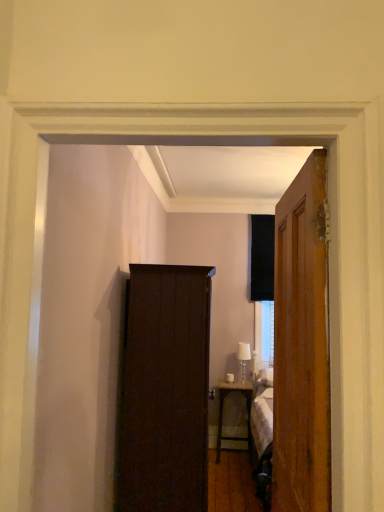
Question: Can you confirm if dark wood cabinet at center is shorter than metallic silver desk at center?

Choices:
 (A) yes
 (B) no

Answer: (B)

Question: Would you consider dark wood cabinet at center to be distant from metallic silver desk at center?

Choices:
 (A) no
 (B) yes

Answer: (B)

Question: Is dark wood cabinet at center facing away from metallic silver desk at center?

Choices:
 (A) yes
 (B) no

Answer: (B)

Question: From the image's perspective, is dark wood cabinet at center below metallic silver desk at center?

Choices:
 (A) yes
 (B) no

Answer: (B)

Question: From a real-world perspective, is dark wood cabinet at center on top of metallic silver desk at center?

Choices:
 (A) no
 (B) yes

Answer: (B)

Question: Is metallic silver desk at center wider or thinner than wooden door at right?

Choices:
 (A) thin
 (B) wide

Answer: (B)

Question: Considering the positions of metallic silver desk at center and wooden door at right in the image, is metallic silver desk at center taller or shorter than wooden door at right?

Choices:
 (A) tall
 (B) short

Answer: (B)

Question: Is metallic silver desk at center in front of or behind wooden door at right in the image?

Choices:
 (A) behind
 (B) front

Answer: (A)

Question: From the image's perspective, is metallic silver desk at center above or below wooden door at right?

Choices:
 (A) above
 (B) below

Answer: (B)

Question: From the image's perspective, is dark wood cabinet at center above or below wooden door at right?

Choices:
 (A) below
 (B) above

Answer: (A)

Question: Is point (162, 309) positioned closer to the camera than point (324, 467)?

Choices:
 (A) farther
 (B) closer

Answer: (A)

Question: Is dark wood cabinet at center in front of or behind wooden door at right in the image?

Choices:
 (A) front
 (B) behind

Answer: (B)

Question: Considering the positions of dark wood cabinet at center and wooden door at right in the image, is dark wood cabinet at center bigger or smaller than wooden door at right?

Choices:
 (A) big
 (B) small

Answer: (A)

Question: Is dark wood cabinet at center to the left or to the right of clear glass lampshade at right in the image?

Choices:
 (A) right
 (B) left

Answer: (B)

Question: Considering the positions of dark wood cabinet at center and clear glass lampshade at right in the image, is dark wood cabinet at center bigger or smaller than clear glass lampshade at right?

Choices:
 (A) big
 (B) small

Answer: (A)